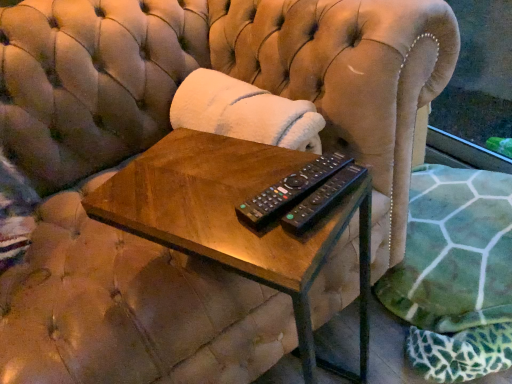
In order to click on vacant area on the back side of black plastic remote at center, the second remote control viewed from the back in this screenshot , I will do `click(265, 160)`.